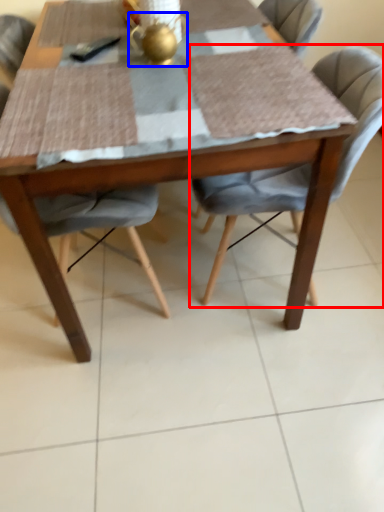
Question: Among these objects, which one is farthest to the camera, chair (highlighted by a red box) or tea pot (highlighted by a blue box)?

Choices:
 (A) chair
 (B) tea pot

Answer: (B)